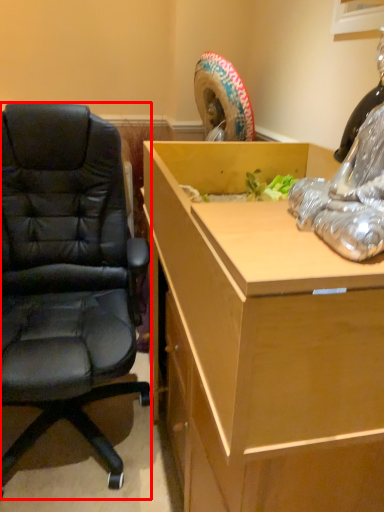
Question: From the image's perspective, what is the correct spatial relationship of chair (annotated by the red box) in relation to desk?

Choices:
 (A) below
 (B) above

Answer: (A)